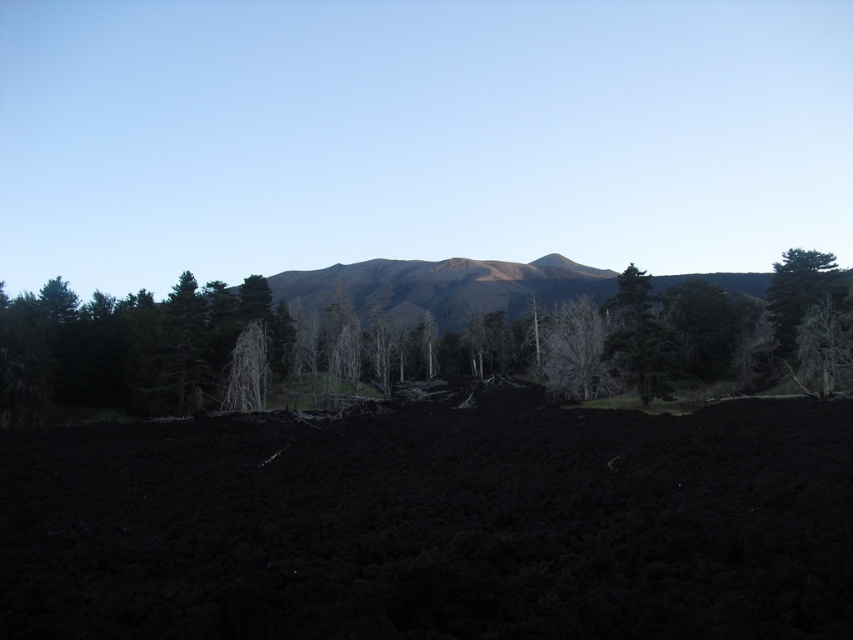
Question: Is dark green textured trees at center positioned behind white matte tree at center?

Choices:
 (A) yes
 (B) no

Answer: (B)

Question: Can you confirm if dark green textured trees at center is smaller than green textured tree at right?

Choices:
 (A) no
 (B) yes

Answer: (A)

Question: Observing the image, what is the correct spatial positioning of white matte tree at center in reference to green textured tree at right?

Choices:
 (A) right
 (B) left

Answer: (B)

Question: Among these objects, which one is farthest from the camera?

Choices:
 (A) dark green textured trees at center
 (B) white matte tree at center
 (C) green textured tree at right

Answer: (B)

Question: Estimate the real-world distances between objects in this image. Which object is farther from the green textured tree at right?

Choices:
 (A) white matte tree at center
 (B) dark green textured trees at center

Answer: (B)

Question: Which point is closer to the camera taking this photo?

Choices:
 (A) (786, 269)
 (B) (751, 275)
 (C) (573, 371)

Answer: (C)